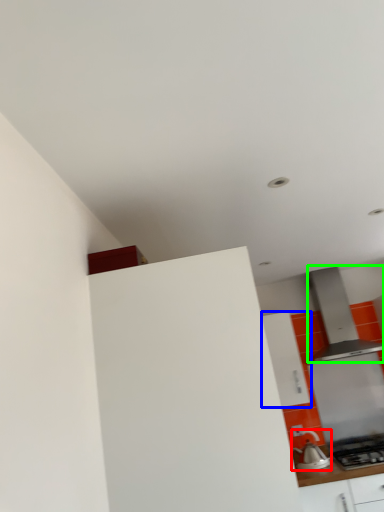
Question: Estimate the real-world distances between objects in this image. Which object is farther from kitchen appliance (highlighted by a red box), cabinetry (highlighted by a blue box) or home appliance (highlighted by a green box)?

Choices:
 (A) cabinetry
 (B) home appliance

Answer: (B)